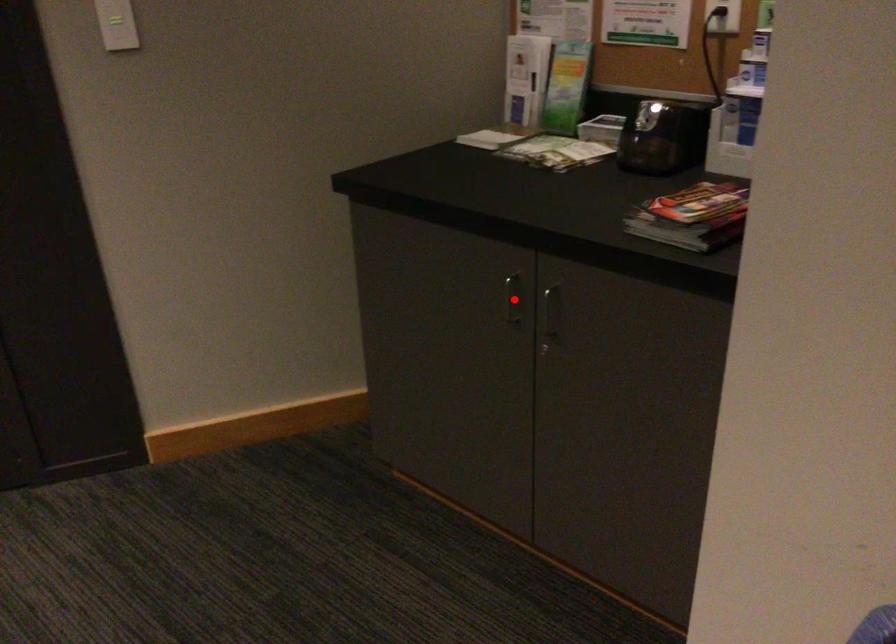
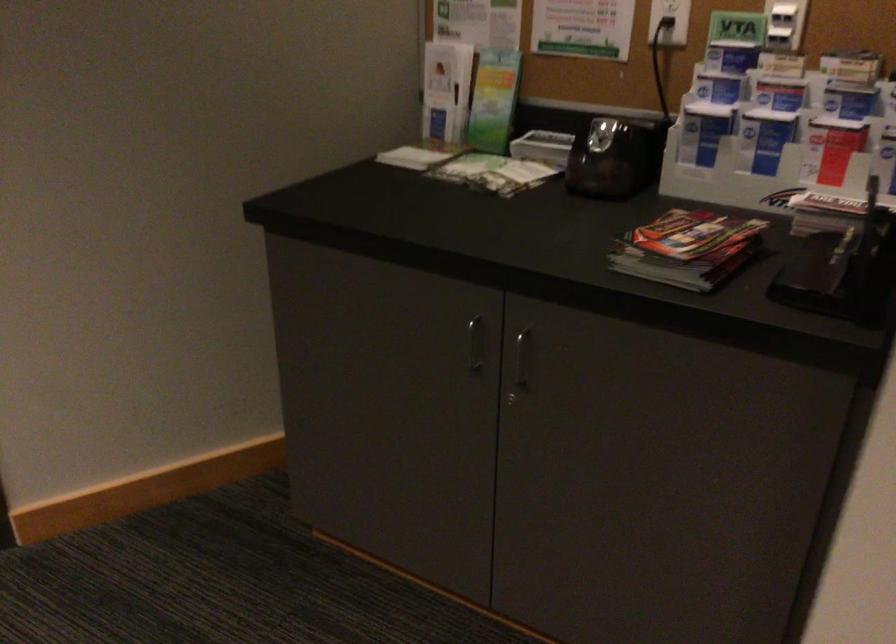
The point at the highlighted location is marked in the first image. Where is the corresponding point in the second image?

(475, 343)